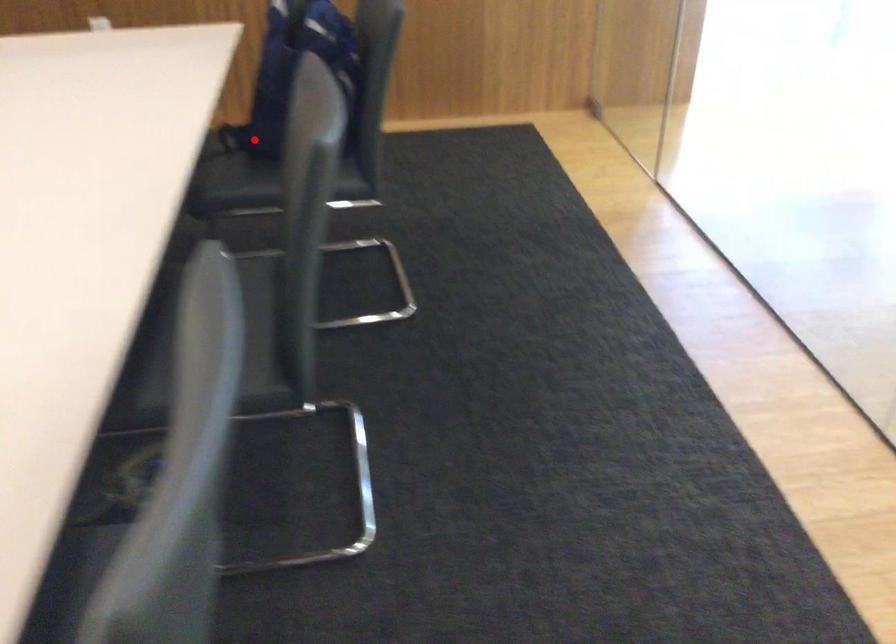
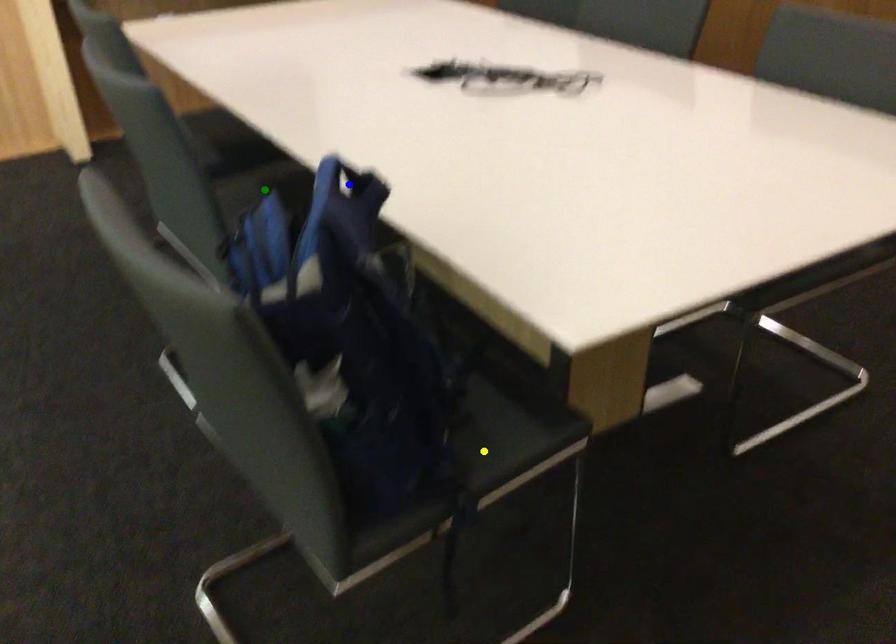
Question: I am providing you with two images of the same scene from different viewpoints. A red point is marked on the first image. You are given multiple points on the second image. Can you choose the point in image 2 that corresponds to the point in image 1?

Choices:
 (A) green point
 (B) yellow point
 (C) blue point

Answer: (B)